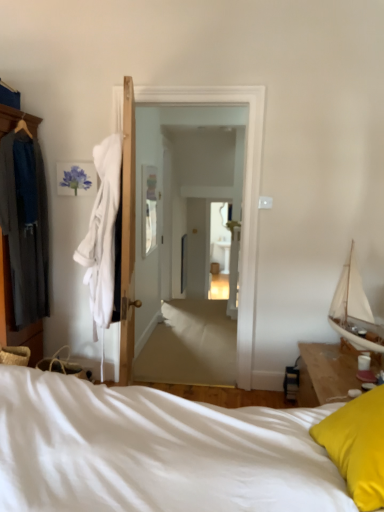
Question: Is white soft robe at left further to the viewer compared to yellow fabric pillow at lower right?

Choices:
 (A) yes
 (B) no

Answer: (A)

Question: Is white soft robe at left smaller than yellow fabric pillow at lower right?

Choices:
 (A) yes
 (B) no

Answer: (B)

Question: Does white soft robe at left have a larger size compared to yellow fabric pillow at lower right?

Choices:
 (A) yes
 (B) no

Answer: (A)

Question: Considering the relative sizes of white soft robe at left and yellow fabric pillow at lower right in the image provided, is white soft robe at left taller than yellow fabric pillow at lower right?

Choices:
 (A) no
 (B) yes

Answer: (B)

Question: Is white soft robe at left oriented away from yellow fabric pillow at lower right?

Choices:
 (A) yes
 (B) no

Answer: (B)

Question: From their relative heights in the image, would you say white soft bed at lower right is taller or shorter than white sailboat at right?

Choices:
 (A) short
 (B) tall

Answer: (B)

Question: Considering the positions of white soft bed at lower right and white sailboat at right in the image, is white soft bed at lower right bigger or smaller than white sailboat at right?

Choices:
 (A) small
 (B) big

Answer: (B)

Question: Do you think white soft bed at lower right is within white sailboat at right, or outside of it?

Choices:
 (A) outside
 (B) inside

Answer: (A)

Question: In the image, is white soft bed at lower right positioned in front of or behind white sailboat at right?

Choices:
 (A) behind
 (B) front

Answer: (B)

Question: From the image's perspective, is white glossy door at center positioned above or below dark gray fabric robe at left?

Choices:
 (A) below
 (B) above

Answer: (A)

Question: In the image, is white glossy door at center positioned in front of or behind dark gray fabric robe at left?

Choices:
 (A) behind
 (B) front

Answer: (A)

Question: Is white glossy door at center bigger or smaller than dark gray fabric robe at left?

Choices:
 (A) big
 (B) small

Answer: (A)

Question: In the image, is white glossy door at center on the left side or the right side of dark gray fabric robe at left?

Choices:
 (A) right
 (B) left

Answer: (A)

Question: Is point (109, 237) closer or farther from the camera than point (130, 474)?

Choices:
 (A) closer
 (B) farther

Answer: (B)

Question: In the image, is white soft robe at left positioned in front of or behind white soft bed at lower right?

Choices:
 (A) front
 (B) behind

Answer: (B)